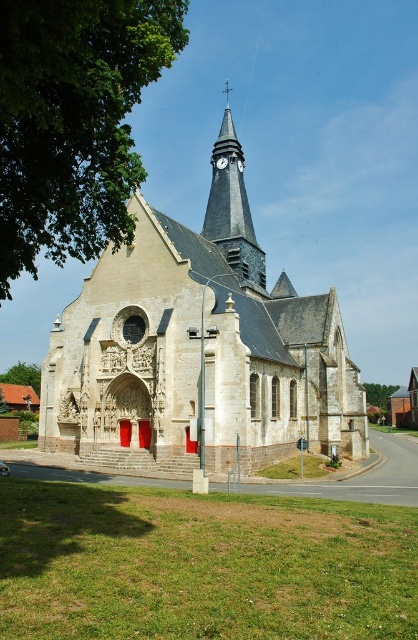
Between light beige stone church at center and green leafy tree at upper left, which one is positioned higher?

Positioned higher is light beige stone church at center.

Who is more distant from viewer, (255, 326) or (94, 90)?

Point (255, 326)

The height and width of the screenshot is (640, 418). In order to click on light beige stone church at center in this screenshot , I will do `click(198, 348)`.

Which of these two, green leafy tree at lower left or metallic clock tower at upper center, stands taller?

green leafy tree at lower left

Who is positioned more to the right, green leafy tree at lower left or metallic clock tower at upper center?

metallic clock tower at upper center

Describe the element at coordinates (22, 374) in the screenshot. The height and width of the screenshot is (640, 418). I see `green leafy tree at lower left` at that location.

Locate an element on the screen. The image size is (418, 640). green leafy tree at lower left is located at coordinates (22, 374).

Which is behind, point (117, 241) or point (226, 163)?

The point (226, 163) is behind.

Consider the image. Is green leafy tree at upper left in front of metallic clock tower at upper center?

Yes.

Does point (150, 51) lie behind point (216, 163)?

No, (150, 51) is in front of (216, 163).

You are a GUI agent. You are given a task and a screenshot of the screen. Output one action in this format:
    pyautogui.click(x=<x>, y=<y>)
    Task: Click on the green leafy tree at upper left
    The width and height of the screenshot is (418, 640).
    Given the screenshot: What is the action you would take?
    pyautogui.click(x=73, y=122)